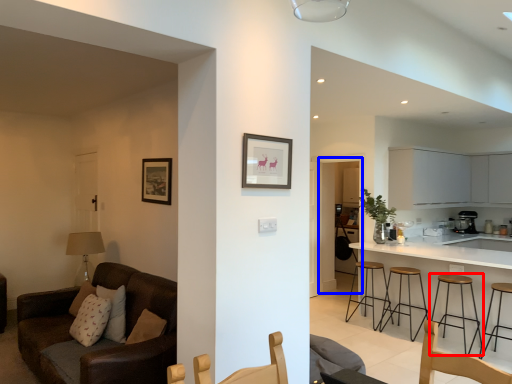
Question: Which point is further to the camera, stool (highlighted by a red box) or glass door (highlighted by a blue box)?

Choices:
 (A) stool
 (B) glass door

Answer: (B)